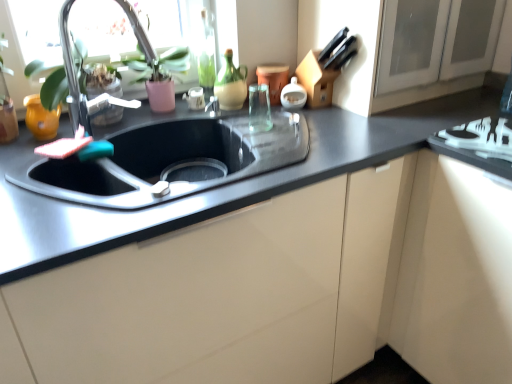
This screenshot has width=512, height=384. I want to click on vacant area that lies in front of matte ceramic cup at upper center, which appears as the second appliance when viewed from the right, so click(272, 115).